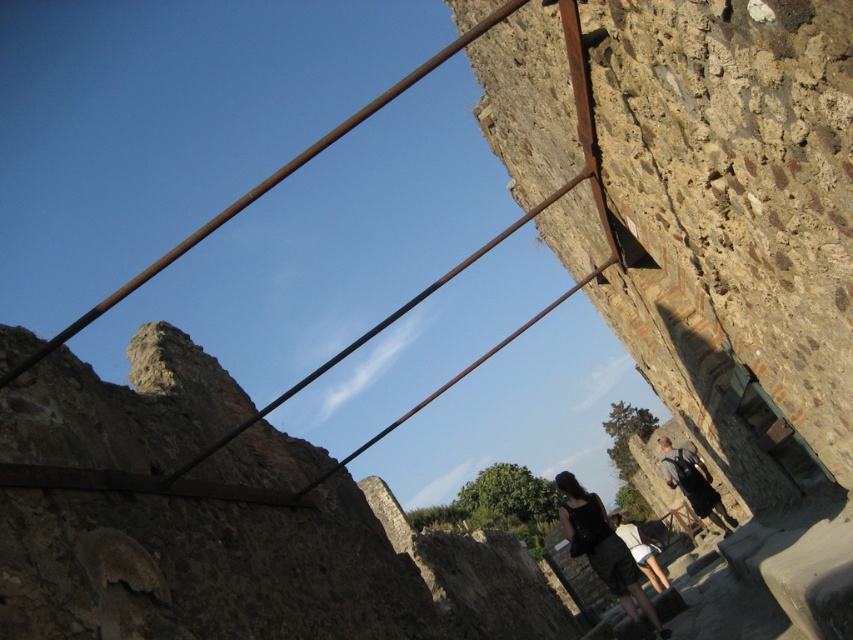
You are an archaeologist standing at the archaeological site. You notice a rusty metal rail at upper center and a white cotton shirt at lower center. Which object is higher in the image?

The rusty metal rail at upper center is taller than the white cotton shirt at lower center, so the rusty metal rail at upper center is higher in the image.

You are an archaeologist carrying a dark gray backpack at center and need to secure a rope to the rusty metal rail at upper center for safety. Given their sizes, will the rail be able to support the backpack adequately?

The rusty metal rail at upper center is larger in size than the dark gray backpack at center, which suggests it can support the backpack adequately as the rail is bigger and presumably stronger.

In the scene shown: You are an archaeologist examining the site and need to determine the relative sizes of the objects for documentation. Which object is wider between the rusty metal rail at upper center and the dark gray fabric dress at center?

The rusty metal rail at upper center is wider than the dark gray fabric dress at center.